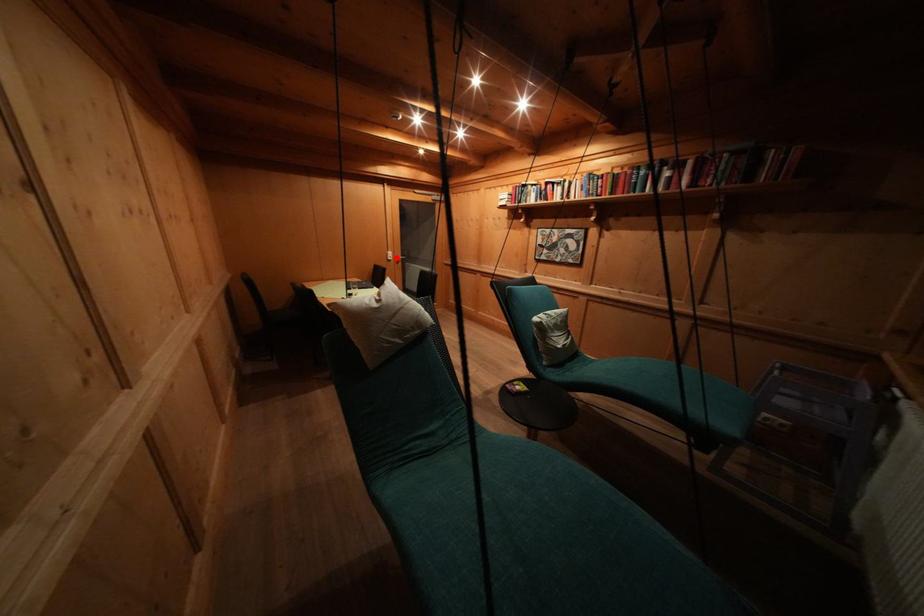
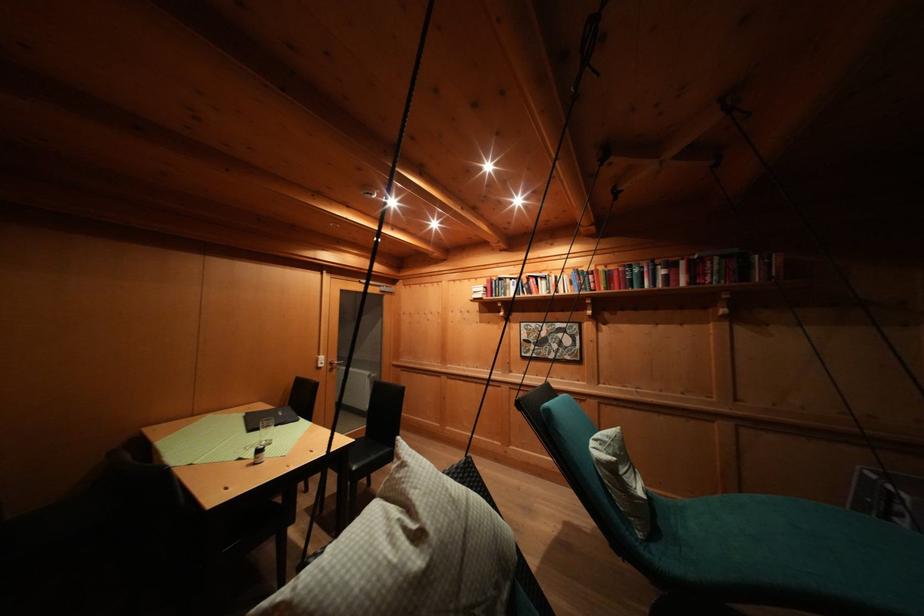
Question: I am providing you with two images of the same scene from different viewpoints. In image1, a red point is highlighted. Considering the same 3D point in image2, which of the following is correct?

Choices:
 (A) It is closer
 (B) It is farther

Answer: (B)